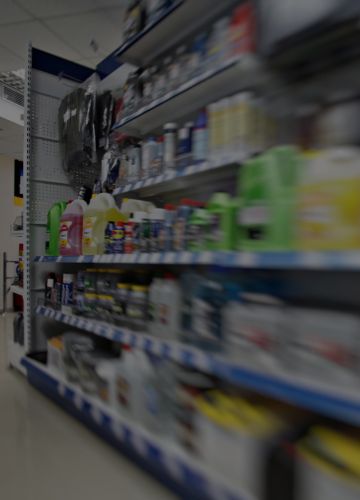
This screenshot has height=500, width=360. Find the location of `top shelf`. top shelf is located at coordinates (144, 33).